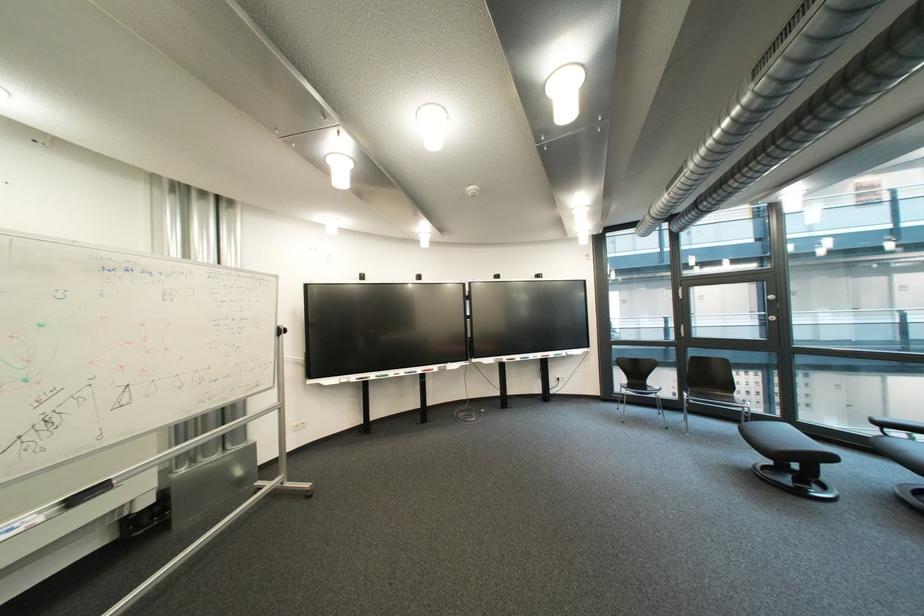
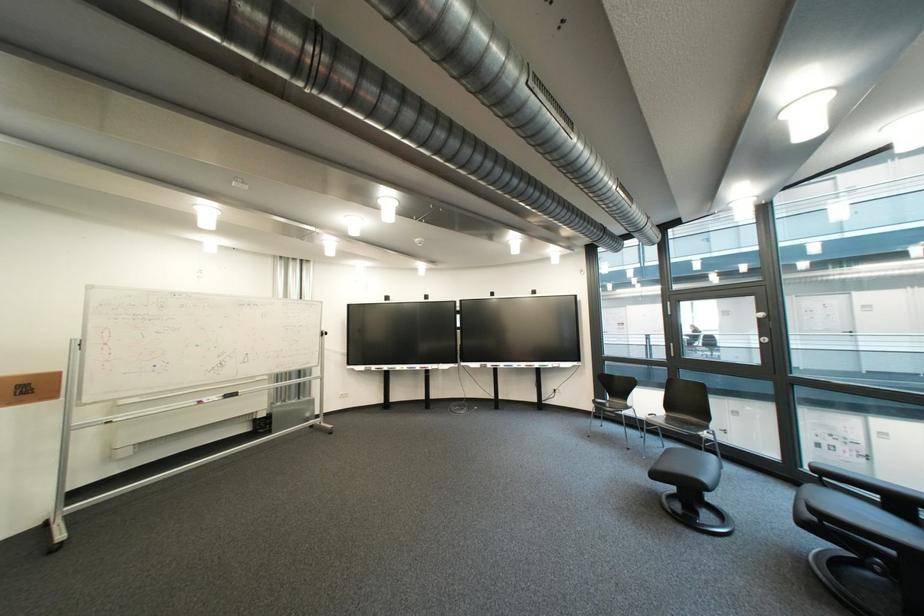
Question: Which direction would the cameraman need to move to produce the second image? Reply with the corresponding letter.

Choices:
 (A) Left
 (B) Right
 (C) Forward
 (D) Backward

Answer: (B)